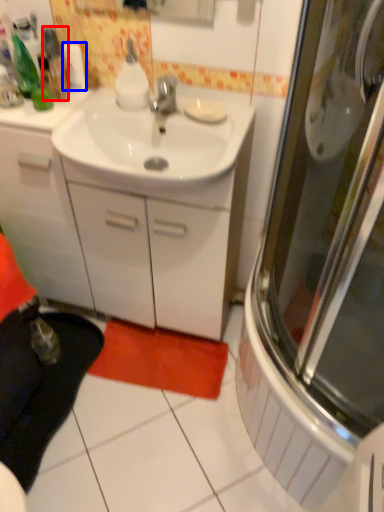
Question: Among these objects, which one is farthest to the camera, bottle (highlighted by a red box) or toilet paper (highlighted by a blue box)?

Choices:
 (A) bottle
 (B) toilet paper

Answer: (B)